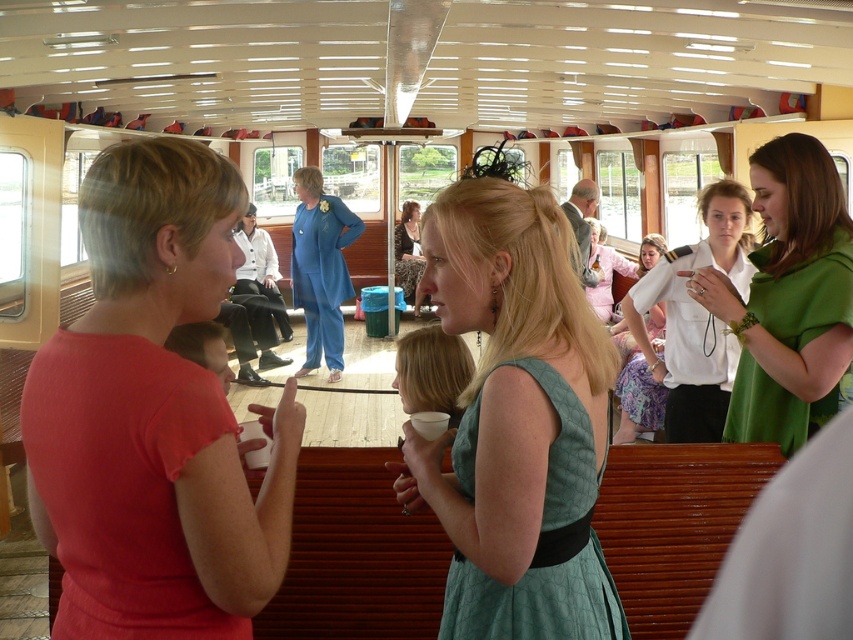
Is green fabric dress at center to the right of white shirt at center from the viewer's perspective?

Indeed, green fabric dress at center is positioned on the right side of white shirt at center.

The image size is (853, 640). I want to click on green fabric dress at center, so click(x=788, y=298).

Does point (764, 333) come farther from viewer compared to point (701, 214)?

No, it is in front of (701, 214).

I want to click on green fabric dress at center, so click(788, 298).

Is green fabric dress at center wider than patterned fabric dress at center?

In fact, green fabric dress at center might be narrower than patterned fabric dress at center.

Between point (740, 355) and point (416, 211), which one is positioned in front?

Positioned in front is point (740, 355).

Measure the distance between point (x=773, y=371) and camera.

8.83 feet

I want to click on green fabric dress at center, so click(788, 298).

Does matte red shirt at left appear on the right side of green fabric dress at center?

No, matte red shirt at left is not to the right of green fabric dress at center.

Locate an element on the screen. matte red shirt at left is located at coordinates (154, 417).